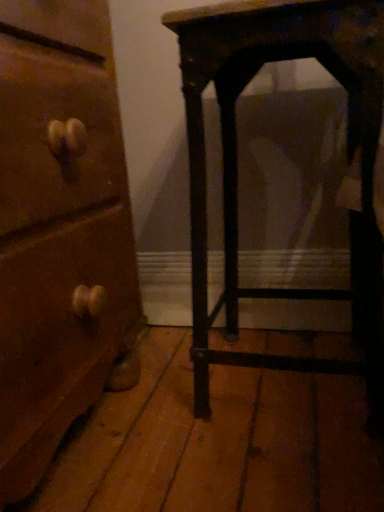
Question: Considering the positions of dark wood table at right and wooden chest of drawers at left in the image, is dark wood table at right taller or shorter than wooden chest of drawers at left?

Choices:
 (A) short
 (B) tall

Answer: (A)

Question: Is dark wood table at right in front of or behind wooden chest of drawers at left in the image?

Choices:
 (A) front
 (B) behind

Answer: (B)

Question: In terms of size, does dark wood table at right appear bigger or smaller than wooden chest of drawers at left?

Choices:
 (A) big
 (B) small

Answer: (B)

Question: From a real-world perspective, relative to dark wood table at right, is wooden chest of drawers at left vertically above or below?

Choices:
 (A) above
 (B) below

Answer: (A)

Question: Considering the positions of wooden chest of drawers at left and dark wood table at right in the image, is wooden chest of drawers at left wider or thinner than dark wood table at right?

Choices:
 (A) thin
 (B) wide

Answer: (B)

Question: Considering the positions of wooden chest of drawers at left and dark wood table at right in the image, is wooden chest of drawers at left taller or shorter than dark wood table at right?

Choices:
 (A) tall
 (B) short

Answer: (A)

Question: Considering the positions of point (6, 300) and point (380, 295), is point (6, 300) closer or farther from the camera than point (380, 295)?

Choices:
 (A) farther
 (B) closer

Answer: (B)